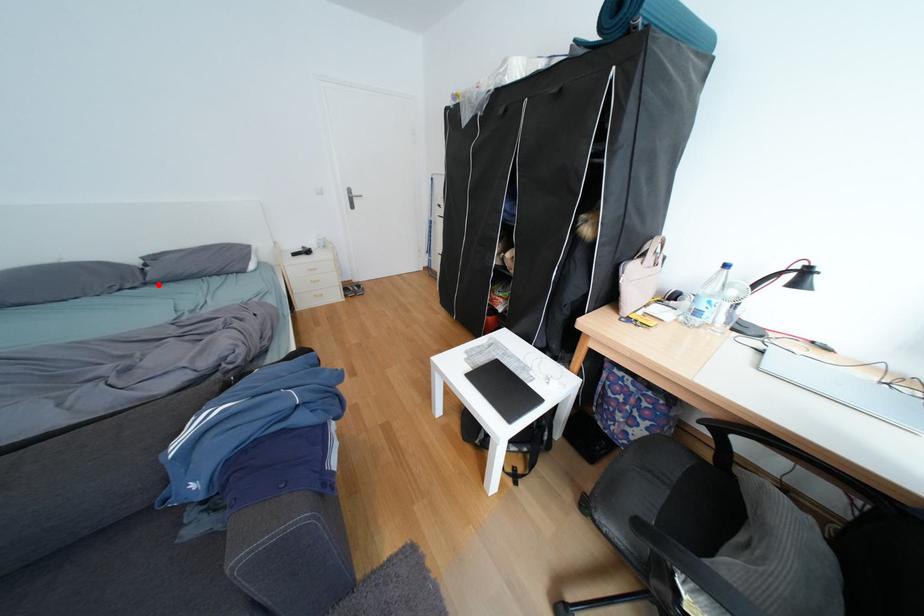
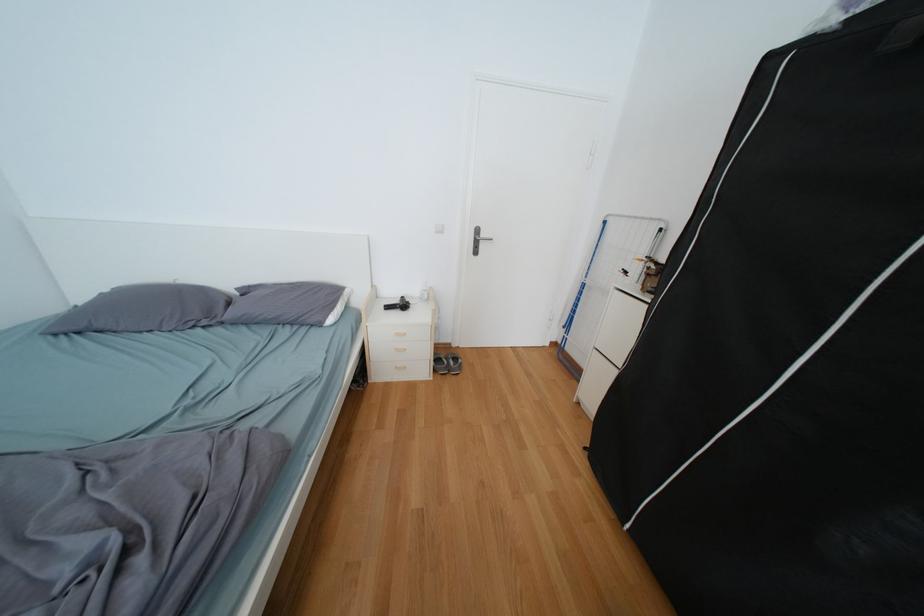
Where in the second image is the point corresponding to the highlighted location from the first image?

(235, 323)